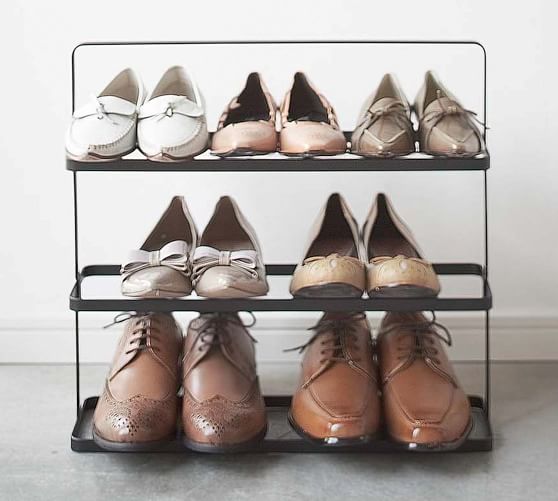
Find the location of a particular element. This screenshot has height=501, width=558. shoes on top rack is located at coordinates point(434,135), point(370,137), point(306,126), point(249,125), point(168,114), point(108,119).